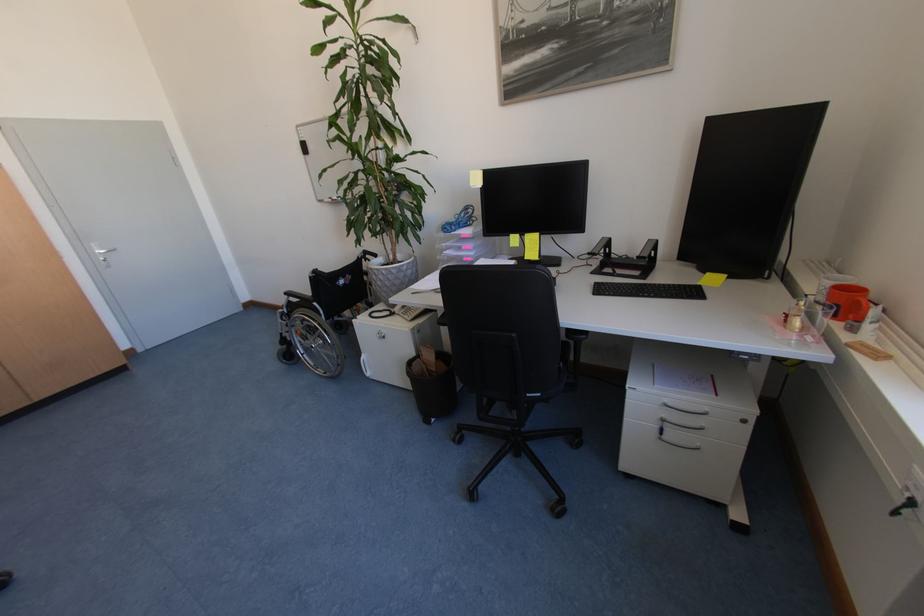
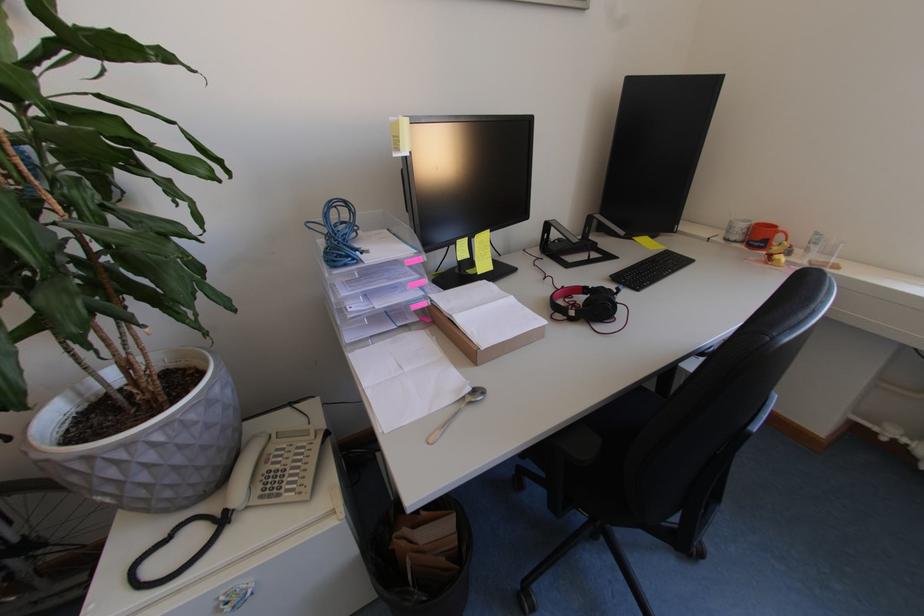
Locate, in the second image, the point that corresponds to (x=454, y=230) in the first image.

(356, 257)